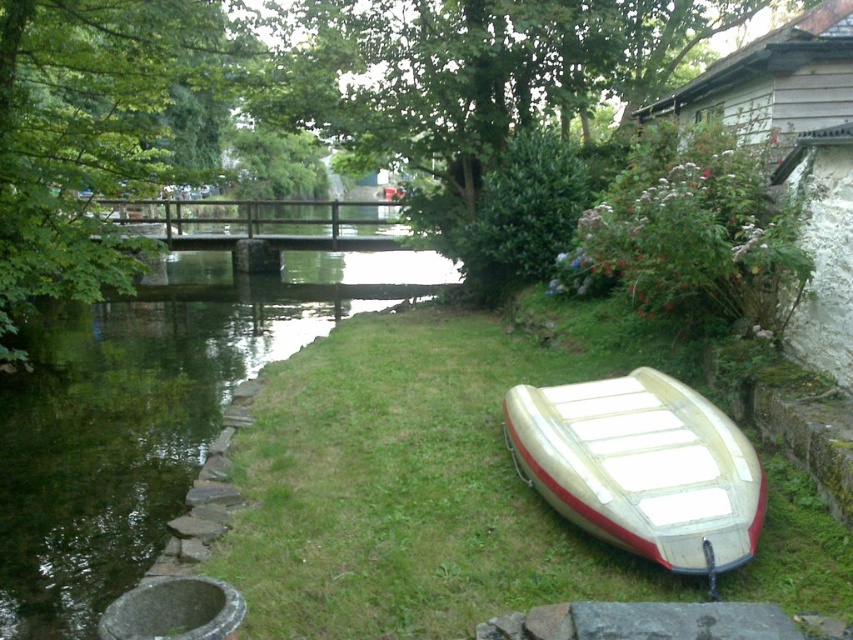
Question: Considering the real-world distances, which object is farthest from the green grass at lower right?

Choices:
 (A) green grassy river at left
 (B) white matte boat at lower right

Answer: (A)

Question: Can you confirm if green grassy river at left is smaller than white matte boat at lower right?

Choices:
 (A) no
 (B) yes

Answer: (A)

Question: Can you confirm if green grassy river at left is bigger than white matte boat at lower right?

Choices:
 (A) no
 (B) yes

Answer: (B)

Question: Can you confirm if green grass at lower right is positioned to the right of white matte boat at lower right?

Choices:
 (A) yes
 (B) no

Answer: (B)

Question: Which object appears closest to the camera in this image?

Choices:
 (A) green grass at lower right
 (B) white matte boat at lower right

Answer: (A)

Question: Which object is farther from the camera taking this photo?

Choices:
 (A) white matte boat at lower right
 (B) green grassy river at left

Answer: (B)